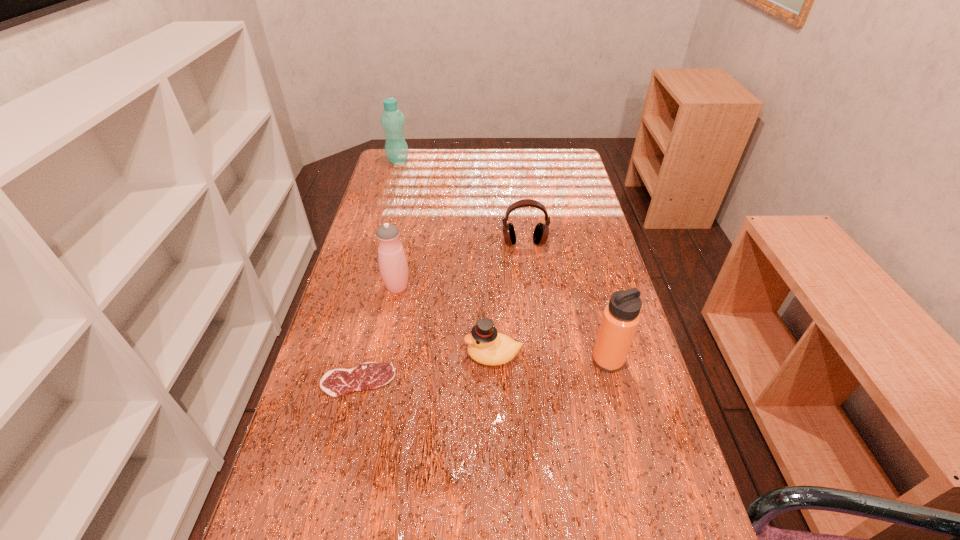
Find the location of a particular element. The width and height of the screenshot is (960, 540). vacant point located between the farthest object and the fifth nearest object is located at coordinates (461, 201).

The image size is (960, 540). Identify the location of vacant point located between the headset and the bottle. (461, 201).

Locate an element on the screen. Image resolution: width=960 pixels, height=540 pixels. unoccupied position between the nearer thermos bottle and the steak is located at coordinates (483, 370).

This screenshot has width=960, height=540. Find the location of `unoccupied position between the farthest object and the left thermos bottle`. unoccupied position between the farthest object and the left thermos bottle is located at coordinates (397, 224).

Identify the location of empty space between the farther thermos bottle and the second farthest object. (461, 265).

Locate an element on the screen. This screenshot has height=540, width=960. free space that is in between the farther thermos bottle and the bottle is located at coordinates (397, 224).

Locate an element on the screen. This screenshot has width=960, height=540. free spot between the fourth nearest object and the fifth tallest object is located at coordinates (445, 321).

This screenshot has height=540, width=960. What are the coordinates of `the second closest object to the second shortest object` in the screenshot? It's located at (621, 316).

Select which object appears as the second closest to the duck. Please provide its 2D coordinates. Your answer should be formatted as a tuple, i.e. [(x, y)], where the tuple contains the x and y coordinates of a point satisfying the conditions above.

[(621, 316)]

Where is `free region that satisfies the following two spatial constraints: 1. on the front-facing side of the rightmost object; 2. on the left side of the second shortest object`? Image resolution: width=960 pixels, height=540 pixels. free region that satisfies the following two spatial constraints: 1. on the front-facing side of the rightmost object; 2. on the left side of the second shortest object is located at coordinates (493, 360).